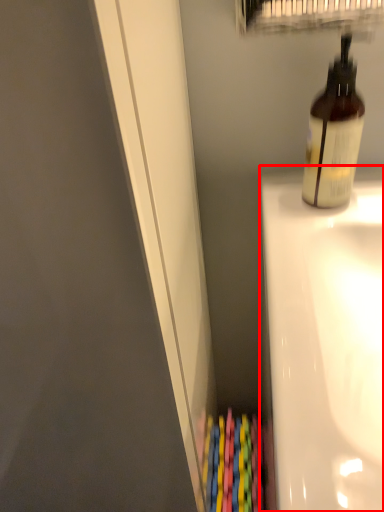
Question: Observing the image, what is the correct spatial positioning of bath (annotated by the red box) in reference to bottle?

Choices:
 (A) right
 (B) left

Answer: (A)